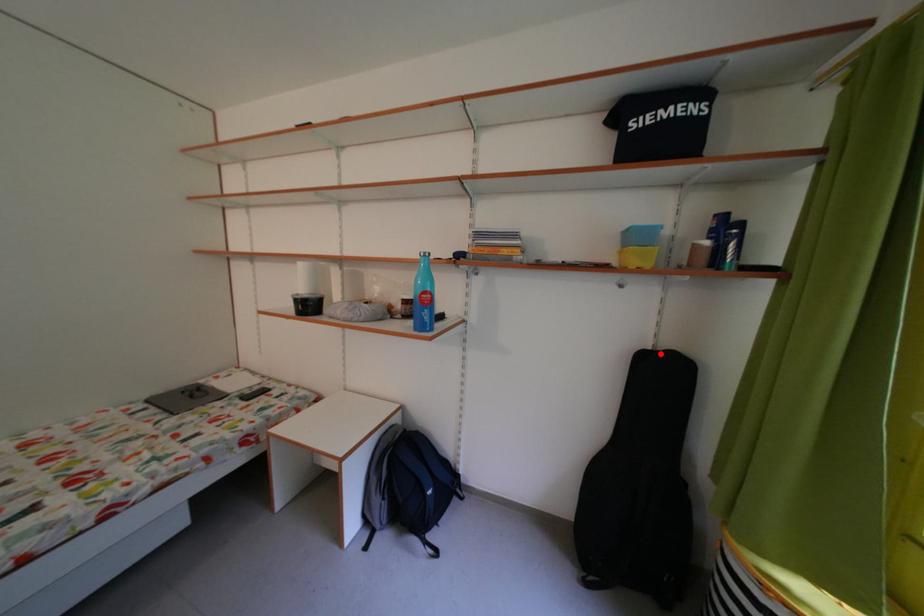
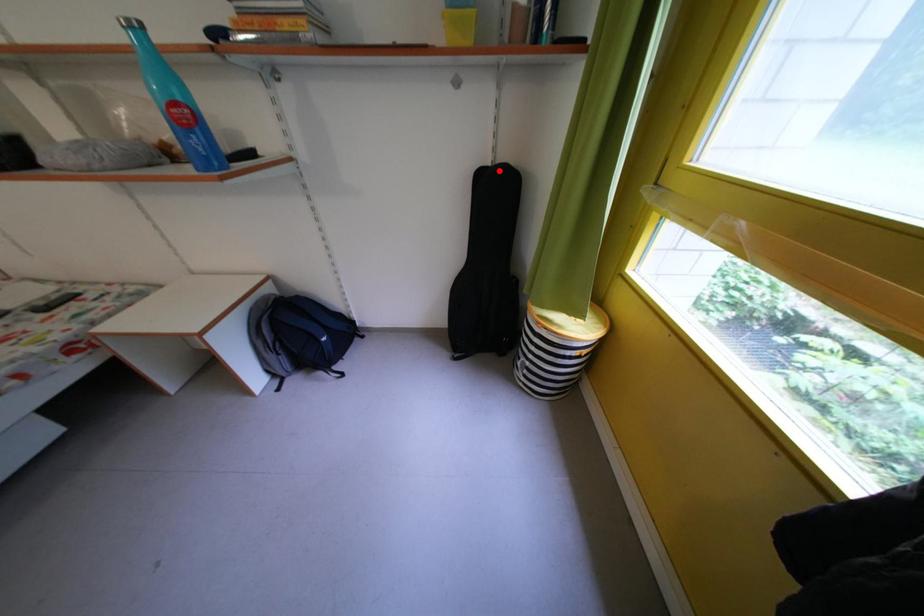
I am providing you with two images of the same scene from different viewpoints. A red point is marked on the first image and another point is marked on the second image. Do the highlighted points in image1 and image2 indicate the same real-world spot?

Yes